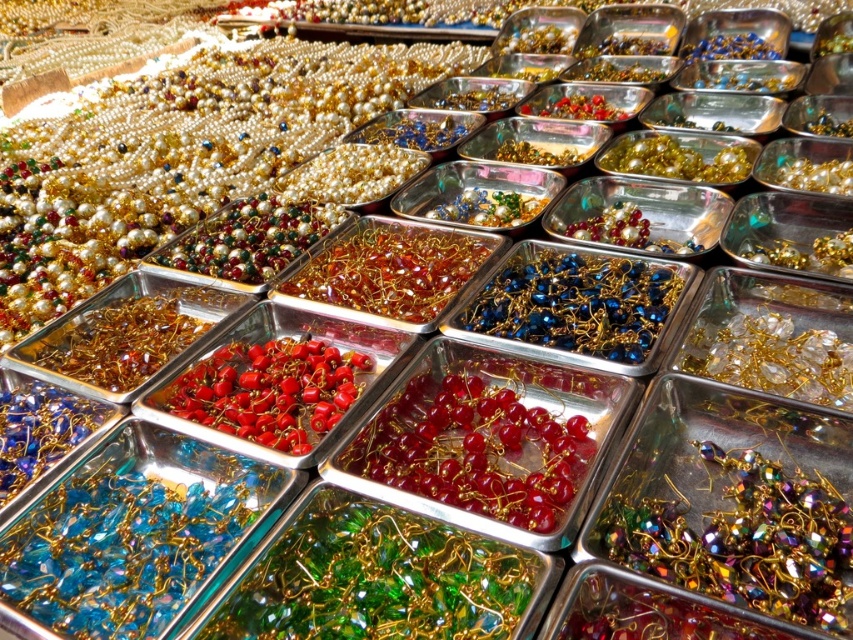
Is multicolored glass beads at center further to the viewer compared to translucent red beads at center?

No, multicolored glass beads at center is in front of translucent red beads at center.

Is multicolored glass beads at center smaller than translucent red beads at center?

Yes.

In order to click on multicolored glass beads at center in this screenshot , I will do tap(746, 540).

Can you confirm if blue metallic beads at center is wider than translucent amber beads at center?

Indeed, blue metallic beads at center has a greater width compared to translucent amber beads at center.

Locate an element on the screen. The image size is (853, 640). blue metallic beads at center is located at coordinates (576, 301).

This screenshot has width=853, height=640. Identify the location of blue metallic beads at center. (576, 301).

Between point (833, 628) and point (369, 300), which one is positioned in front?

Positioned in front is point (833, 628).

Between multicolored glass beads at center and translucent amber beads at center, which one has more height?

translucent amber beads at center is taller.

Between point (814, 506) and point (419, 252), which one is positioned behind?

Point (419, 252)

You are a GUI agent. You are given a task and a screenshot of the screen. Output one action in this format:
    pyautogui.click(x=<x>, y=<y>)
    Task: Click on the multicolored glass beads at center
    
    Given the screenshot: What is the action you would take?
    pyautogui.click(x=746, y=540)